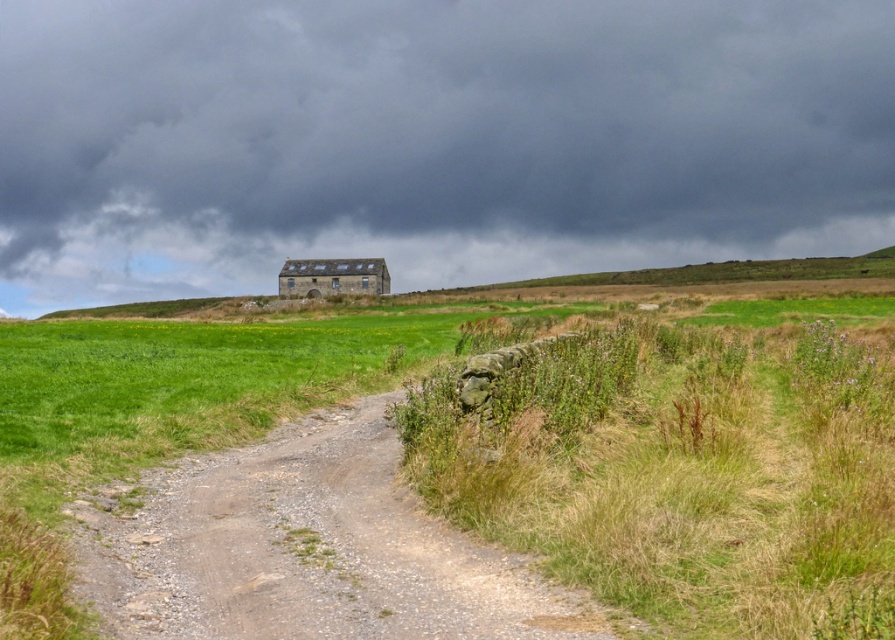
Does point (396, 124) lie behind point (100, 576)?

Yes, point (396, 124) is behind point (100, 576).

Which is in front, point (782, 99) or point (348, 541)?

Point (348, 541) is in front.

Where is `dark gray stone wall at upper center`? The height and width of the screenshot is (640, 895). dark gray stone wall at upper center is located at coordinates (431, 140).